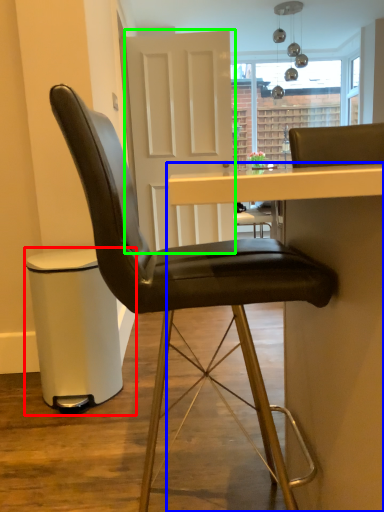
Question: Based on their relative distances, which object is nearer to bar stool (highlighted by a red box)? Choose from table (highlighted by a blue box) and glass door (highlighted by a green box).

Choices:
 (A) table
 (B) glass door

Answer: (A)